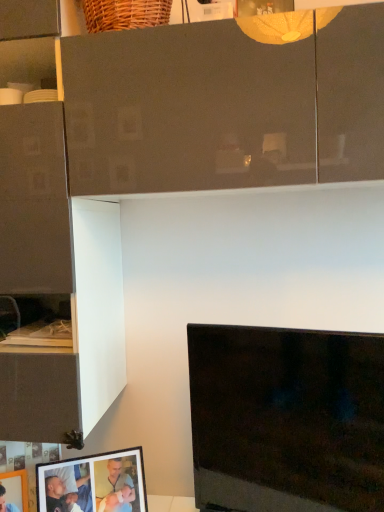
Question: Is matte black picture frame at lower left, placed as the second picture frame when sorted from right to left, closer to the viewer compared to black glossy tv at lower right?

Choices:
 (A) no
 (B) yes

Answer: (A)

Question: Is matte black picture frame at lower left, placed as the 1th picture frame when sorted from left to right, not inside black glossy tv at lower right?

Choices:
 (A) no
 (B) yes

Answer: (B)

Question: Does matte black picture frame at lower left, placed as the 1th picture frame when sorted from left to right, have a smaller size compared to black glossy tv at lower right?

Choices:
 (A) no
 (B) yes

Answer: (B)

Question: From a real-world perspective, does matte black picture frame at lower left, placed as the 1th picture frame when sorted from left to right, stand above black glossy tv at lower right?

Choices:
 (A) no
 (B) yes

Answer: (A)

Question: Considering the relative sizes of matte black picture frame at lower left, placed as the second picture frame when sorted from right to left, and black glossy tv at lower right in the image provided, is matte black picture frame at lower left, placed as the second picture frame when sorted from right to left, bigger than black glossy tv at lower right?

Choices:
 (A) yes
 (B) no

Answer: (B)

Question: Is matte black picture frame at lower left, placed as the 1th picture frame when sorted from left to right, wider than black glossy tv at lower right?

Choices:
 (A) yes
 (B) no

Answer: (B)

Question: Is black glossy tv at lower right located within matte black picture frame at lower left, arranged as the 1th picture frame when viewed from the right?

Choices:
 (A) no
 (B) yes

Answer: (A)

Question: Does matte black picture frame at lower left, marked as the 2th picture frame in a left-to-right arrangement, appear on the right side of black glossy tv at lower right?

Choices:
 (A) yes
 (B) no

Answer: (B)

Question: From the image's perspective, is matte black picture frame at lower left, marked as the 2th picture frame in a left-to-right arrangement, beneath black glossy tv at lower right?

Choices:
 (A) no
 (B) yes

Answer: (B)

Question: Is matte black picture frame at lower left, arranged as the 1th picture frame when viewed from the right, at the left side of black glossy tv at lower right?

Choices:
 (A) no
 (B) yes

Answer: (B)

Question: Is matte black picture frame at lower left, arranged as the 1th picture frame when viewed from the right, touching black glossy tv at lower right?

Choices:
 (A) yes
 (B) no

Answer: (B)

Question: Is matte black picture frame at lower left, arranged as the 1th picture frame when viewed from the right, positioned before black glossy tv at lower right?

Choices:
 (A) no
 (B) yes

Answer: (A)

Question: Is black glossy tv at lower right smaller than matte black picture frame at lower left, placed as the 1th picture frame when sorted from left to right?

Choices:
 (A) yes
 (B) no

Answer: (B)